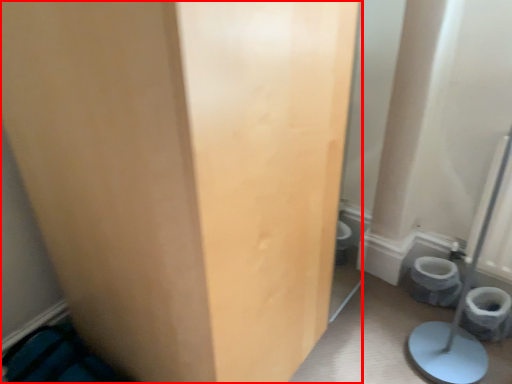
Question: From the image, what is the correct spatial relationship of door (annotated by the red box) in relation to toilet bowl?

Choices:
 (A) left
 (B) right

Answer: (A)